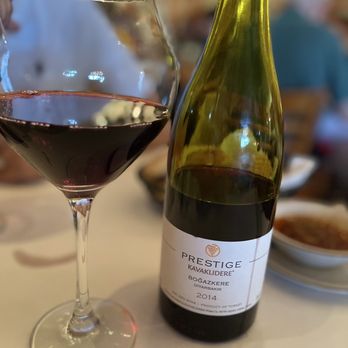
Find the location of a particular element. table is located at coordinates (329, 332).